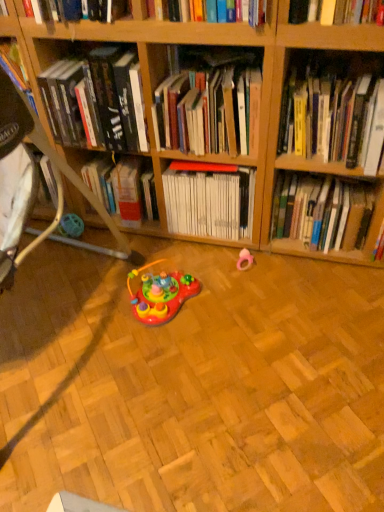
Identify the location of free location in front of pink rubber ring at center, which is the first toy in right-to-left order. The width and height of the screenshot is (384, 512). (258, 294).